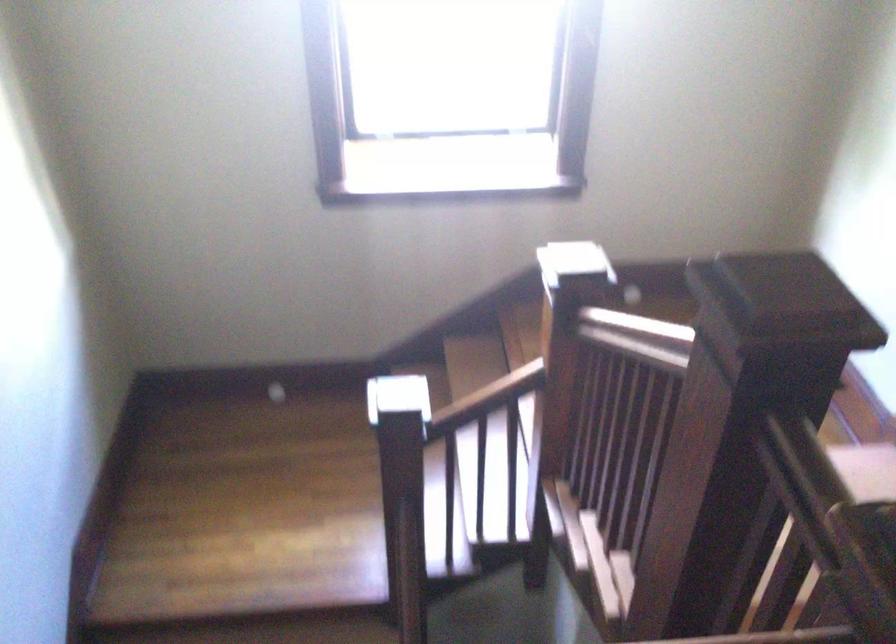
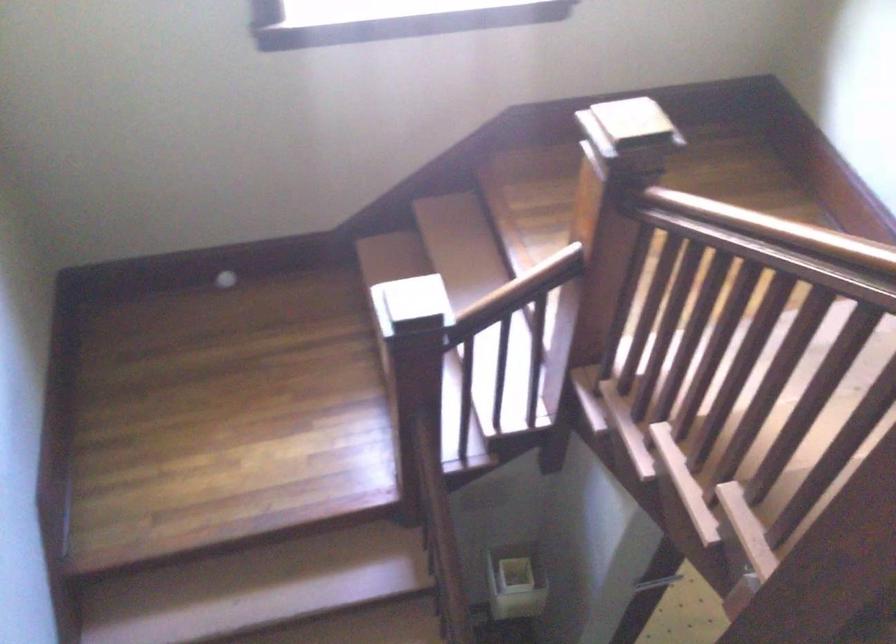
Locate, in the second image, the point that corresponds to (397,453) in the first image.

(410, 366)